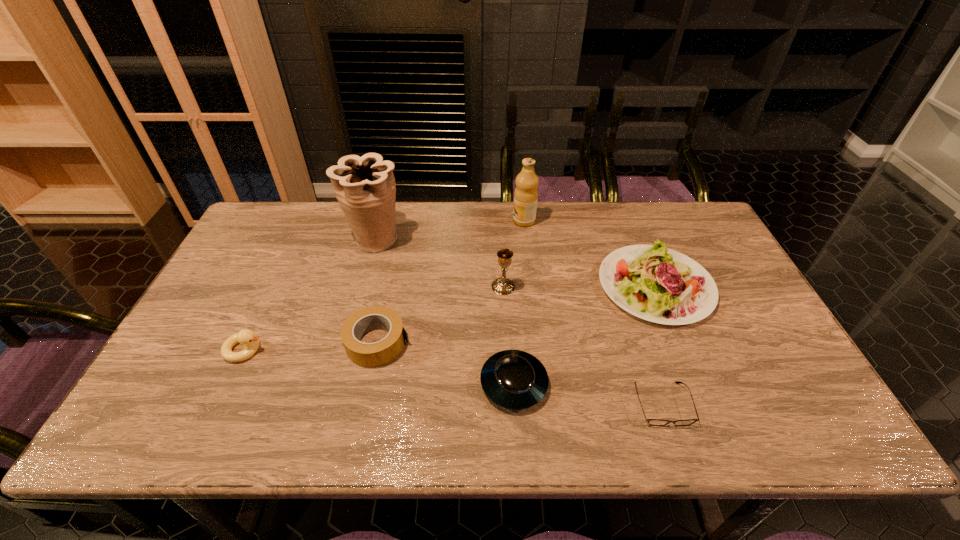
In order to click on urn in this screenshot , I will do `click(365, 187)`.

Where is `olive oil`? The image size is (960, 540). olive oil is located at coordinates (526, 193).

Where is `the third tallest object`? the third tallest object is located at coordinates (502, 286).

Identify the location of salad plate. (655, 283).

At what (x,y) coordinates should I click in order to perform the action: click on duckling. Please return your answer as a coordinate pair (x, y). This screenshot has height=540, width=960. Looking at the image, I should click on (251, 342).

In order to click on duct tape in this screenshot , I will do `click(382, 352)`.

Where is `saucer`? saucer is located at coordinates 513,379.

Identify the location of spectacles. (654, 422).

Identify the location of vacant space located on the left of the urn. (305, 239).

You are a GUI agent. You are given a task and a screenshot of the screen. Output one action in this format:
    pyautogui.click(x=<x>, y=<y>)
    Task: Click on the vacant region located 0.090m on the label of the olive oil
    This screenshot has height=540, width=960.
    Given the screenshot: What is the action you would take?
    pyautogui.click(x=486, y=221)